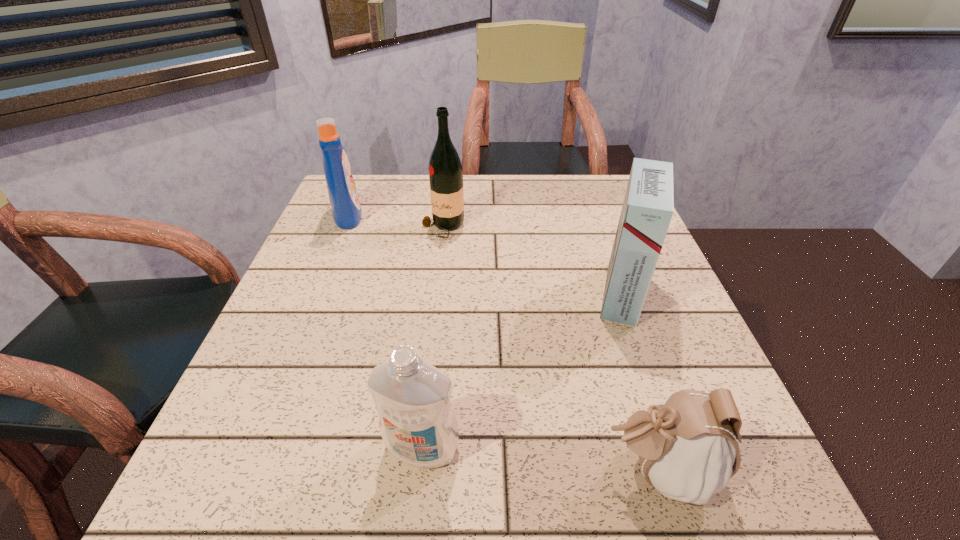
The width and height of the screenshot is (960, 540). Find the location of `free space located on the right of the right detergent`. free space located on the right of the right detergent is located at coordinates [560, 447].

You are a GUI agent. You are given a task and a screenshot of the screen. Output one action in this format:
    pyautogui.click(x=<x>, y=<y>)
    Task: Click on the vacant region located on the front-facing side of the shortest object
    The height and width of the screenshot is (540, 960).
    Given the screenshot: What is the action you would take?
    (547, 470)

Locate an element on the screen. The image size is (960, 540). vacant position located on the front-facing side of the shortest object is located at coordinates (554, 470).

The height and width of the screenshot is (540, 960). What are the coordinates of `vacant space located on the front-facing side of the shortest object` in the screenshot? It's located at (485, 470).

At what (x,y) coordinates should I click in order to perform the action: click on wine bottle at the far edge. Please return your answer as a coordinate pair (x, y). The image size is (960, 540). Looking at the image, I should click on (445, 170).

I want to click on detergent situated at the far edge, so click(x=346, y=211).

I want to click on detergent that is at the near edge, so click(x=417, y=422).

Where is `pouch that is positioned at the near edge`? pouch that is positioned at the near edge is located at coordinates (687, 446).

Identify the location of object at the left edge. The height and width of the screenshot is (540, 960). (346, 211).

Identify the location of cigarette case that is at the right edge. Image resolution: width=960 pixels, height=540 pixels. (648, 207).